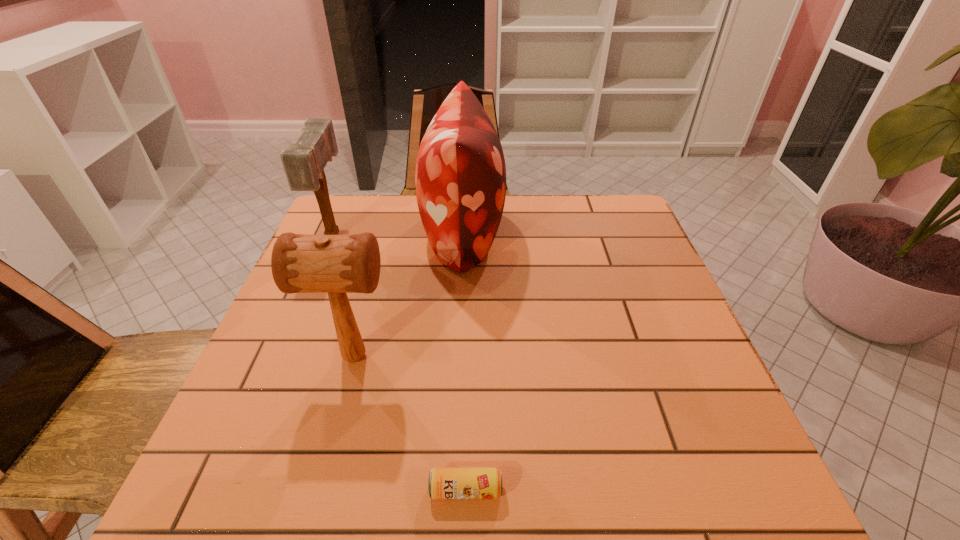
Where is `free point between the third farthest object and the cushion`? This screenshot has height=540, width=960. free point between the third farthest object and the cushion is located at coordinates (409, 294).

Locate which object is the second closest to the third object from right to left. Please provide its 2D coordinates. Your answer should be formatted as a tuple, i.e. [(x, y)], where the tuple contains the x and y coordinates of a point satisfying the conditions above.

[(444, 483)]

The image size is (960, 540). Find the location of `object that is the closest one to the third object from right to left`. object that is the closest one to the third object from right to left is located at coordinates (460, 177).

This screenshot has height=540, width=960. What are the coordinates of `vacant area that satisfies the following two spatial constraints: 1. on the strike surface of the second object from left to right; 2. on the back side of the shortest object` in the screenshot? It's located at (320, 490).

This screenshot has width=960, height=540. I want to click on vacant region that satisfies the following two spatial constraints: 1. on the back side of the nearest object; 2. on the front-facing side of the cushion, so click(472, 232).

Where is `free location that satisfies the following two spatial constraints: 1. on the strike surface of the right mallet; 2. on the left side of the nearest object`? The width and height of the screenshot is (960, 540). free location that satisfies the following two spatial constraints: 1. on the strike surface of the right mallet; 2. on the left side of the nearest object is located at coordinates (320, 490).

Find the location of `free point that satisfies the following two spatial constraints: 1. on the front-facing side of the cushion; 2. on the front side of the farther mallet`. free point that satisfies the following two spatial constraints: 1. on the front-facing side of the cushion; 2. on the front side of the farther mallet is located at coordinates (463, 235).

I want to click on vacant position in the image that satisfies the following two spatial constraints: 1. on the strike surface of the second nearest object; 2. on the back side of the nearest object, so click(x=320, y=490).

The image size is (960, 540). In order to click on free spot that satisfies the following two spatial constraints: 1. on the front-facing side of the shortest object; 2. on the right side of the cushion in this screenshot , I will do `click(450, 490)`.